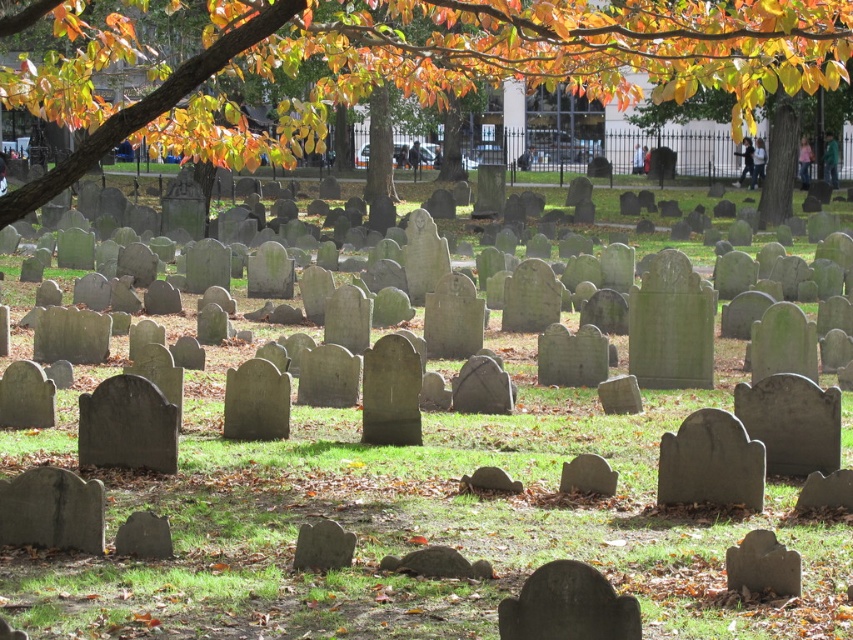
You are standing in the cemetery and notice the autumn leaves at upper center. Based on their position, can you determine if they are closer to the front or the back of the image?

The autumn leaves at upper center are located at point 0.102 on the horizontal axis, which places them closer to the left edge of the image. However, their vertical position at 0.481 places them near the center of the image vertically. Since the image does not provide depth cues beyond their coordinates, their proximity to the front or back cannot be definitively determined based solely on the given coordinates.